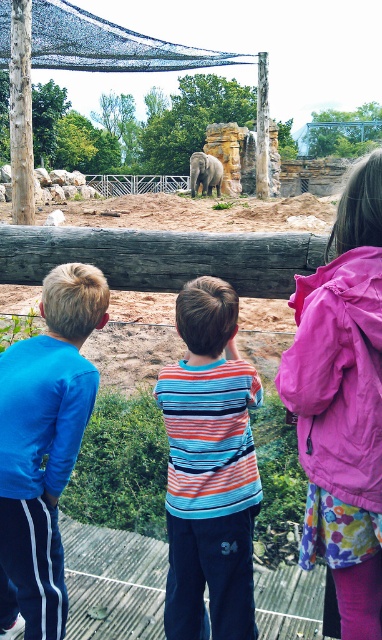
Who is positioned more to the left, striped cotton shirt at center or gray textured elephant at center?

Positioned to the left is striped cotton shirt at center.

Measure the distance between striped cotton shirt at center and gray textured elephant at center.

striped cotton shirt at center and gray textured elephant at center are 29.04 meters apart from each other.

The width and height of the screenshot is (382, 640). What are the coordinates of `striped cotton shirt at center` in the screenshot? It's located at (210, 468).

Which is below, pink fabric jacket at upper right or striped cotton shirt at center?

striped cotton shirt at center

Consider the image. Who is positioned more to the left, pink fabric jacket at upper right or striped cotton shirt at center?

Positioned to the left is striped cotton shirt at center.

Is point (312, 515) positioned behind point (173, 413)?

No, it is in front of (173, 413).

Locate an element on the screen. pink fabric jacket at upper right is located at coordinates (343, 403).

Is blue track pants at left shorter than gray textured elephant at center?

Indeed, blue track pants at left has a lesser height compared to gray textured elephant at center.

Is blue track pants at left to the right of gray textured elephant at center from the viewer's perspective?

Incorrect, blue track pants at left is not on the right side of gray textured elephant at center.

Between point (21, 454) and point (194, 168), which one is positioned in front?

Point (21, 454) is in front.

Find the location of a particular element. The height and width of the screenshot is (640, 382). blue track pants at left is located at coordinates (43, 448).